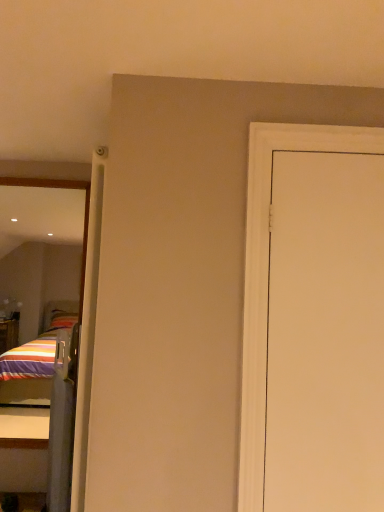
Question: Is clear plastic screen door at left taller than white matte door at right?

Choices:
 (A) no
 (B) yes

Answer: (A)

Question: Is clear plastic screen door at left closer to the viewer compared to white matte door at right?

Choices:
 (A) yes
 (B) no

Answer: (B)

Question: Considering the relative sizes of clear plastic screen door at left and white matte door at right in the image provided, is clear plastic screen door at left smaller than white matte door at right?

Choices:
 (A) no
 (B) yes

Answer: (A)

Question: Considering the relative sizes of clear plastic screen door at left and white matte door at right in the image provided, is clear plastic screen door at left wider than white matte door at right?

Choices:
 (A) no
 (B) yes

Answer: (B)

Question: Is clear plastic screen door at left facing towards white matte door at right?

Choices:
 (A) yes
 (B) no

Answer: (B)

Question: From a real-world perspective, is clear plastic screen door at left located beneath white matte door at right?

Choices:
 (A) yes
 (B) no

Answer: (A)

Question: Is reflective glass mirror at left positioned with its back to white matte door at right?

Choices:
 (A) no
 (B) yes

Answer: (A)

Question: From the image's perspective, is reflective glass mirror at left under white matte door at right?

Choices:
 (A) yes
 (B) no

Answer: (A)

Question: Is reflective glass mirror at left behind white matte door at right?

Choices:
 (A) yes
 (B) no

Answer: (A)

Question: Considering the relative sizes of reflective glass mirror at left and white matte door at right in the image provided, is reflective glass mirror at left smaller than white matte door at right?

Choices:
 (A) yes
 (B) no

Answer: (B)

Question: Is reflective glass mirror at left oriented towards white matte door at right?

Choices:
 (A) no
 (B) yes

Answer: (A)

Question: Is white matte door at right a part of reflective glass mirror at left?

Choices:
 (A) no
 (B) yes

Answer: (A)

Question: Is white matte door at right in front of reflective glass mirror at left?

Choices:
 (A) yes
 (B) no

Answer: (A)